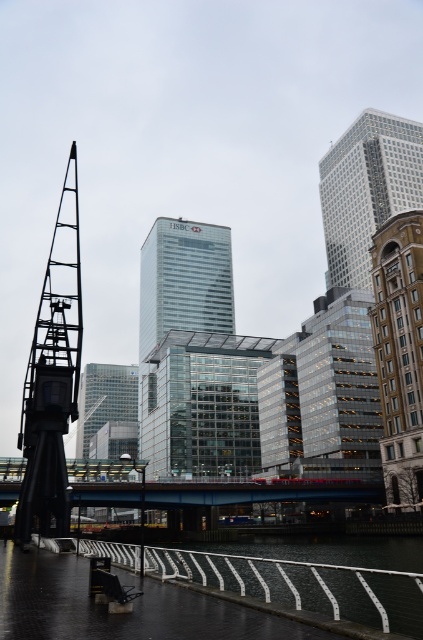
You are standing at the center of the wet pavement in the urban scene. You want to move towards the black metal crane at left. Which direction should you walk?

You should walk to the left since the black metal crane at left is located at point (x=52, y=378), which is to the left of your current position at the center of the wet pavement.

You are a photographer planning to take a picture of the glassy skyscraper at center. However, you notice the black metal crane at left is blocking your view. Can you confirm if the crane is between you and the skyscraper?

Yes, the black metal crane at left is in front of the glassy skyscraper at center, so it is blocking your view.

You are standing at the edge of the pavement looking towards the black crane. There are two points marked in the image. Which point, point 1 at coordinates (69, 396) or point 2 at coordinates (153, 225), is closer to you?

Point 1 at coordinates (69, 396) is closer to you than point 2 at coordinates (153, 225).